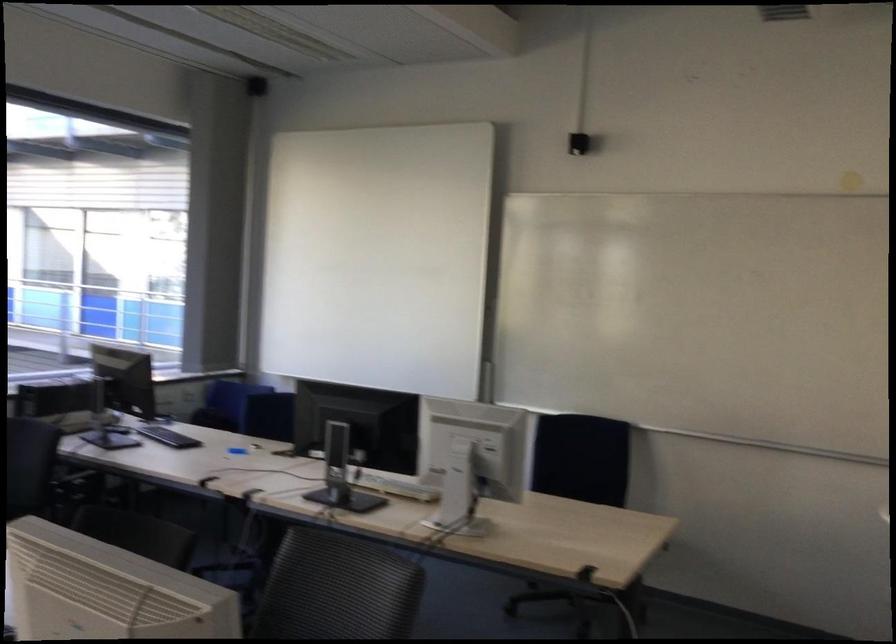
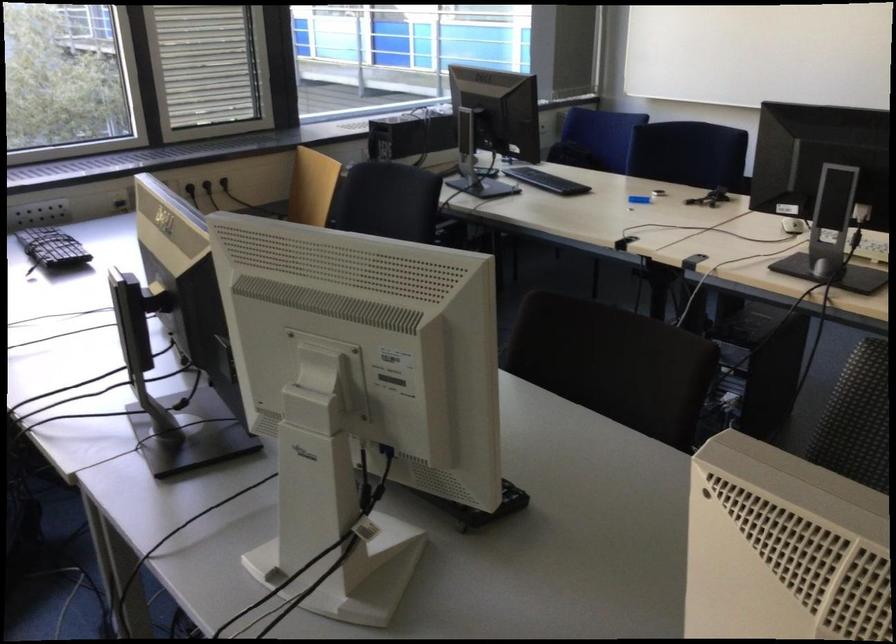
What movement of the cameraman would produce the second image?

The movement direction of the cameraman is left, forward.